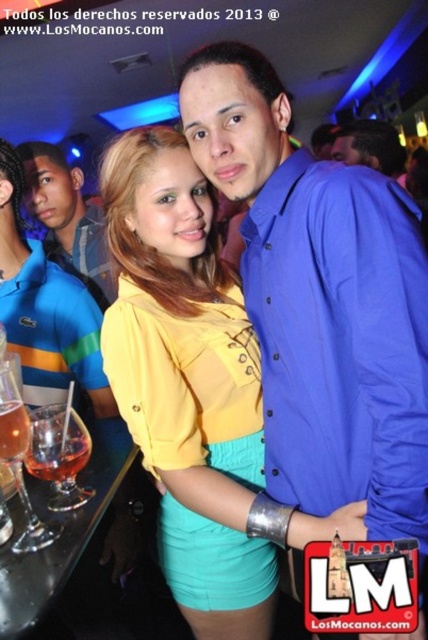
Question: Does blue button-up shirt at center appear under translucent glass wine at lower left?

Choices:
 (A) yes
 (B) no

Answer: (B)

Question: Does translucent glass wine glass at lower left come in front of translucent glass drink at bar left?

Choices:
 (A) yes
 (B) no

Answer: (A)

Question: Is matte blue shirt at center thinner than translucent glass wine glass at lower left?

Choices:
 (A) yes
 (B) no

Answer: (B)

Question: Estimate the real-world distances between objects in this image. Which object is closer to the blue shirt at center?

Choices:
 (A) translucent glass drink at bar left
 (B) blue striped polo shirt at left

Answer: (B)

Question: Which point is closer to the camera taking this photo?

Choices:
 (A) (80, 440)
 (B) (294, 152)

Answer: (B)

Question: Which object appears farthest from the camera in this image?

Choices:
 (A) translucent glass wine at lower left
 (B) blue button-up shirt at center

Answer: (A)